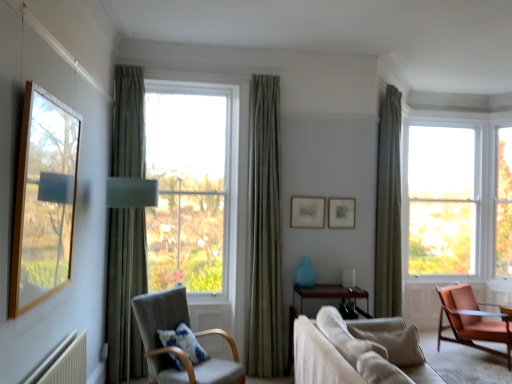
Where is `vacant region to the left of matte blue glass table lamp at center`? Image resolution: width=512 pixels, height=384 pixels. vacant region to the left of matte blue glass table lamp at center is located at coordinates (334, 282).